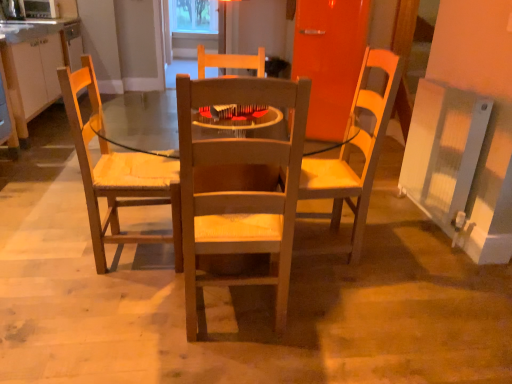
The height and width of the screenshot is (384, 512). Identify the location of vacant space in front of wooden chair at left. (130, 296).